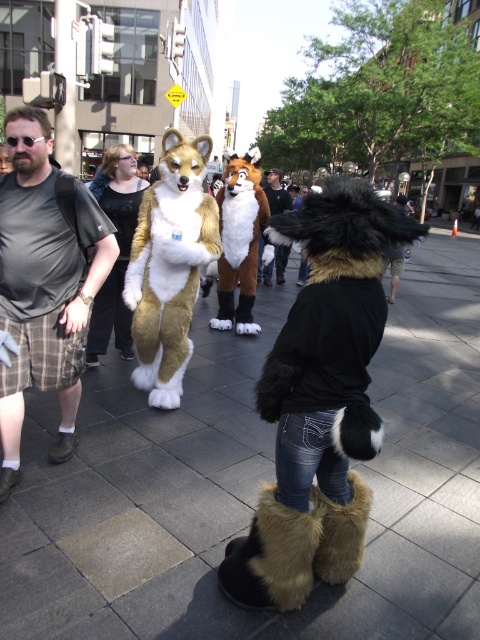
Question: Does brown plush fox at center have a larger size compared to brown fur coat at center?

Choices:
 (A) yes
 (B) no

Answer: (A)

Question: Which object is positioned farthest from the fuzzy brown and white fox at center?

Choices:
 (A) brown fur coat at center
 (B) matte black shirt at center

Answer: (A)

Question: Which object appears farthest from the camera in this image?

Choices:
 (A) brown fur coat at center
 (B) brown plush fox at center
 (C) matte black shirt at center
 (D) plaid cotton shorts at lower left

Answer: (A)

Question: Which object is farther from the camera taking this photo?

Choices:
 (A) gray concrete pavement at center
 (B) fuzzy brown and white fox at center
 (C) brown fur coat at center

Answer: (C)

Question: Can you confirm if gray concrete pavement at center is positioned above plaid cotton shorts at lower left?

Choices:
 (A) yes
 (B) no

Answer: (B)

Question: Does matte black shirt at center appear on the left side of brown fur coat at center?

Choices:
 (A) yes
 (B) no

Answer: (A)